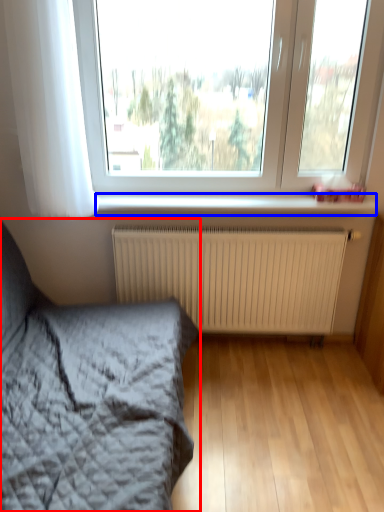
Question: Which of the following is the closest to the observer, bed (highlighted by a red box) or window sill (highlighted by a blue box)?

Choices:
 (A) bed
 (B) window sill

Answer: (A)